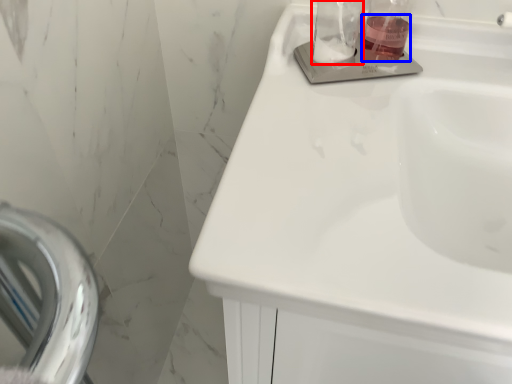
Question: Which of the following is the closest to the observer, glass jar (highlighted by a red box) or liquid (highlighted by a blue box)?

Choices:
 (A) glass jar
 (B) liquid

Answer: (A)